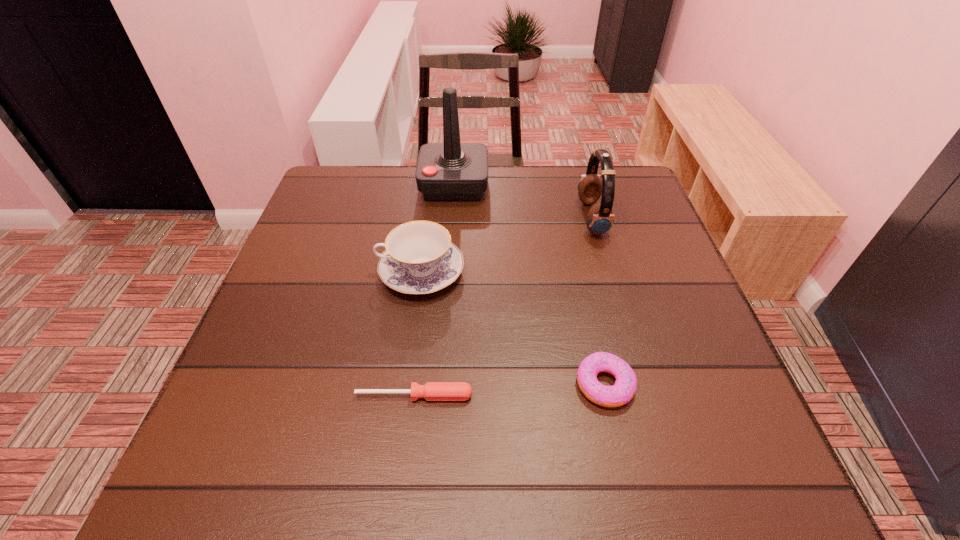
At what (x,y) coordinates should I click in order to perform the action: click on free space between the second shortest object and the screwdriver. Please return your answer as a coordinate pair (x, y). The width and height of the screenshot is (960, 540). Looking at the image, I should click on (510, 390).

Where is `unoccupied area between the third nearest object and the screwdriver`? The height and width of the screenshot is (540, 960). unoccupied area between the third nearest object and the screwdriver is located at coordinates (418, 334).

Image resolution: width=960 pixels, height=540 pixels. Identify the location of free spot between the third tallest object and the screwdriver. 418,334.

This screenshot has height=540, width=960. I want to click on free space between the doughnut and the fourth shortest object, so click(598, 301).

Identify the location of object that is the second nearest to the third shortest object. (432, 391).

Identify which object is the nearest to the third shortest object. Please provide its 2D coordinates. Your answer should be formatted as a tuple, i.e. [(x, y)], where the tuple contains the x and y coordinates of a point satisfying the conditions above.

[(450, 171)]